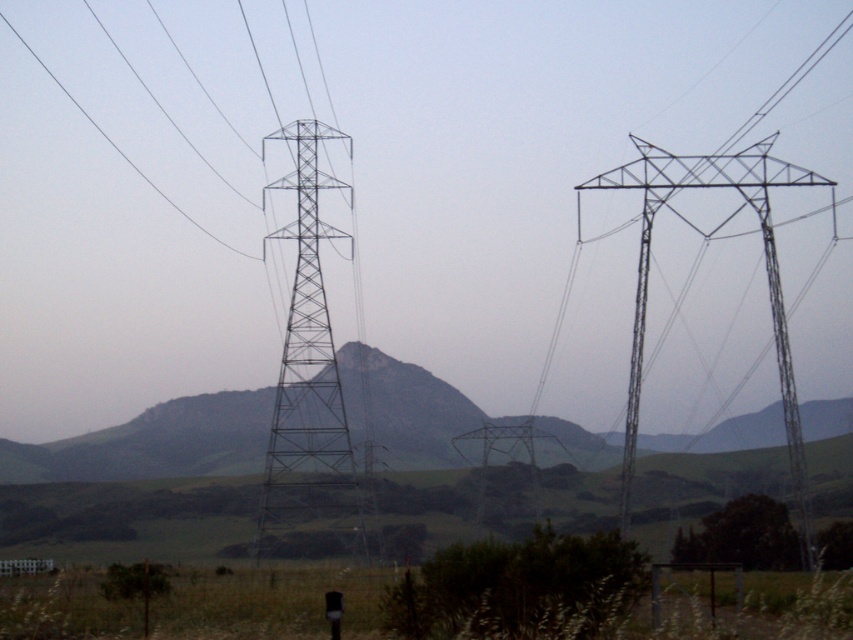
Question: Which of the following is the closest to the observer?

Choices:
 (A) (798, 180)
 (B) (299, 180)

Answer: (A)

Question: Which of the following is the closest to the observer?

Choices:
 (A) (766, 145)
 (B) (103, 436)

Answer: (A)

Question: Is rocky gray mountain at center bigger than metallic silver tower at right?

Choices:
 (A) no
 (B) yes

Answer: (A)

Question: From the image, what is the correct spatial relationship of metallic gray tower at center in relation to metallic silver tower at right?

Choices:
 (A) above
 (B) below

Answer: (B)

Question: Which point is closer to the camera?

Choices:
 (A) metallic gray tower at center
 (B) rocky gray mountain at center

Answer: (A)

Question: Does rocky gray mountain at center have a larger size compared to metallic gray tower at center?

Choices:
 (A) no
 (B) yes

Answer: (B)